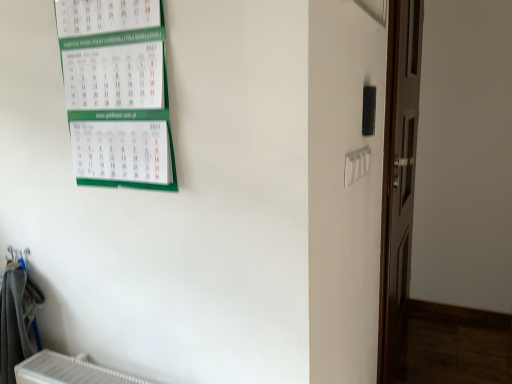
Question: Is brown wooden door at right spatially inside green paper calendar at upper left, or outside of it?

Choices:
 (A) inside
 (B) outside

Answer: (B)

Question: From the image's perspective, is brown wooden door at right positioned above or below green paper calendar at upper left?

Choices:
 (A) below
 (B) above

Answer: (A)

Question: Which of these objects is positioned closest to the gray fabric laundry at lower left?

Choices:
 (A) green paper calendar at upper left
 (B) brown wooden door at right

Answer: (A)

Question: Which of these objects is positioned closest to the brown wooden door at right?

Choices:
 (A) green paper calendar at upper left
 (B) gray fabric laundry at lower left

Answer: (A)